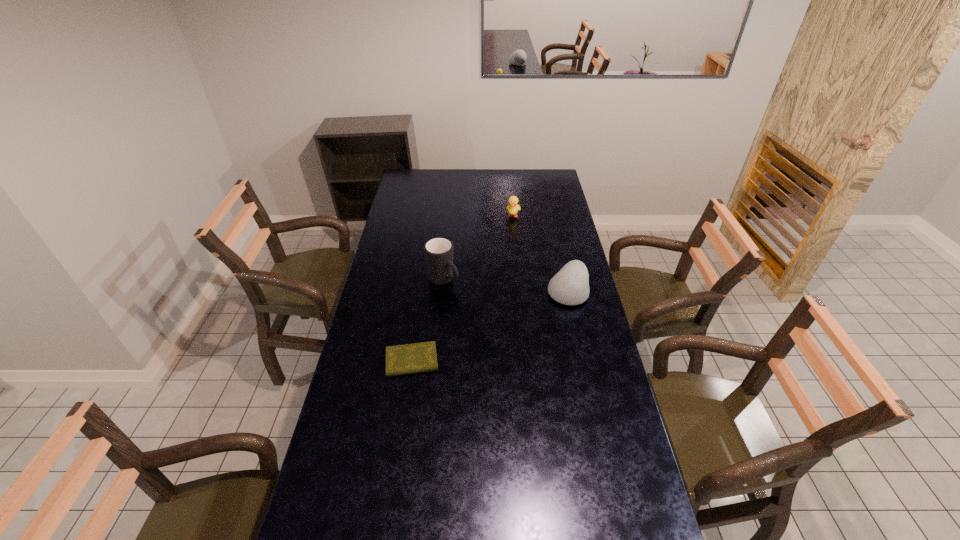
This screenshot has height=540, width=960. What are the coordinates of `diary` in the screenshot? It's located at (405, 359).

What are the coordinates of `the nearest object` in the screenshot? It's located at (405, 359).

Identify the location of beanie. This screenshot has width=960, height=540. (570, 286).

Identify the location of the third object from left to right. This screenshot has height=540, width=960. (513, 208).

You are a GUI agent. You are given a task and a screenshot of the screen. Output one action in this format:
    pyautogui.click(x=<x>, y=<y>)
    Task: Click on the duckling
    This screenshot has width=960, height=540.
    Given the screenshot: What is the action you would take?
    pyautogui.click(x=513, y=208)

This screenshot has height=540, width=960. I want to click on the tallest object, so pyautogui.click(x=438, y=251).

Find the location of a particular element. blank space located 0.120m on the right of the nearest object is located at coordinates (473, 361).

Where is `vacant space situated on the front of the rightmost object`? vacant space situated on the front of the rightmost object is located at coordinates (579, 343).

The height and width of the screenshot is (540, 960). I want to click on vacant space situated on the front-facing side of the duckling, so click(x=510, y=234).

Identify the location of free point located on the front-facing side of the duckling. The height and width of the screenshot is (540, 960). (511, 232).